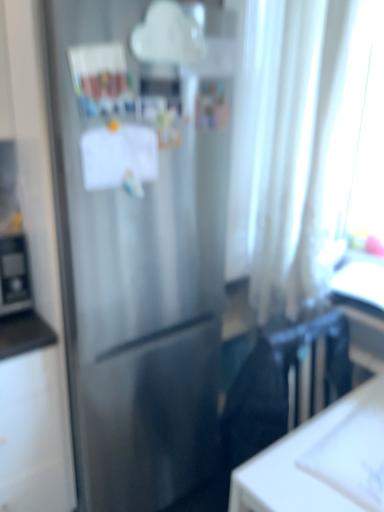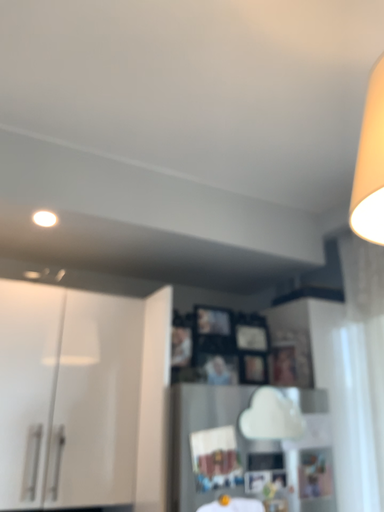
Question: Which way did the camera rotate in the video?

Choices:
 (A) rotated upward
 (B) rotated downward

Answer: (A)